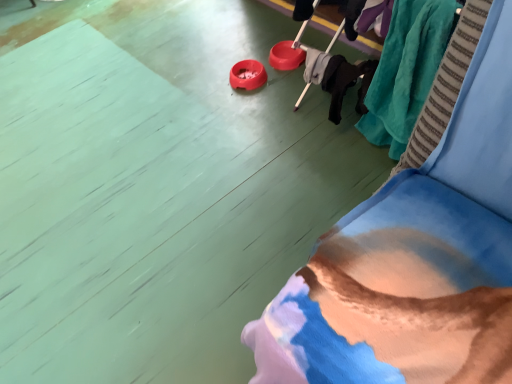
The image size is (512, 384). Describe the element at coordinates (414, 260) in the screenshot. I see `velvet blue couch at lower right` at that location.

Where is `velvet blue couch at lower right`? This screenshot has height=384, width=512. velvet blue couch at lower right is located at coordinates (414, 260).

The image size is (512, 384). I want to click on teal plush blanket at upper right, so click(x=406, y=70).

This screenshot has width=512, height=384. Describe the element at coordinates (406, 70) in the screenshot. I see `teal plush blanket at upper right` at that location.

You are a GUI agent. You are given a task and a screenshot of the screen. Output one action in this format:
    pyautogui.click(x=<x>, y=<y>)
    Task: Click on the velvet blue couch at lower right
    The height and width of the screenshot is (384, 512).
    Given the screenshot: What is the action you would take?
    pyautogui.click(x=414, y=260)

Which object is positioned more to the right, velvet blue couch at lower right or teal plush blanket at upper right?

teal plush blanket at upper right is more to the right.

Which object is further away from the camera taking this photo, velvet blue couch at lower right or teal plush blanket at upper right?

teal plush blanket at upper right.

Does point (396, 242) appear closer or farther from the camera than point (426, 7)?

Point (396, 242) is closer to the camera than point (426, 7).

From the image's perspective, which is above, velvet blue couch at lower right or teal plush blanket at upper right?

From the image's view, velvet blue couch at lower right is above.

From a real-world perspective, which object stands above the other?

From a 3D spatial view, teal plush blanket at upper right is above.

Does velvet blue couch at lower right have a lesser width compared to teal plush blanket at upper right?

No.

Does velvet blue couch at lower right have a lesser height compared to teal plush blanket at upper right?

Indeed, velvet blue couch at lower right has a lesser height compared to teal plush blanket at upper right.

Which of these two, velvet blue couch at lower right or teal plush blanket at upper right, is smaller?

Smaller between the two is teal plush blanket at upper right.

Can we say velvet blue couch at lower right lies outside teal plush blanket at upper right?

velvet blue couch at lower right lies outside teal plush blanket at upper right's area.

Is velvet blue couch at lower right not near teal plush blanket at upper right?

That's not correct — velvet blue couch at lower right is a little close to teal plush blanket at upper right.

Is teal plush blanket at upper right at the back of velvet blue couch at lower right?

No, teal plush blanket at upper right is not at the back of velvet blue couch at lower right.

Locate an element on the screen. The height and width of the screenshot is (384, 512). clothing behind the velvet blue couch at lower right is located at coordinates (406, 70).

Is teal plush blanket at upper right at the right side of velvet blue couch at lower right?

Yes.

Relative to velvet blue couch at lower right, is teal plush blanket at upper right in front or behind?

In the image, teal plush blanket at upper right appears behind velvet blue couch at lower right.

Does point (395, 98) appear closer or farther from the camera than point (395, 292)?

Point (395, 98) is farther from the camera than point (395, 292).

From the image's perspective, which one is positioned lower, teal plush blanket at upper right or velvet blue couch at lower right?

teal plush blanket at upper right is shown below in the image.

Based on the photo, from a real-world perspective, between teal plush blanket at upper right and velvet blue couch at lower right, who is vertically lower?

velvet blue couch at lower right, from a real-world perspective.

In terms of width, does teal plush blanket at upper right look wider or thinner when compared to velvet blue couch at lower right?

In the image, teal plush blanket at upper right appears to be more narrow than velvet blue couch at lower right.

Does teal plush blanket at upper right have a greater height compared to velvet blue couch at lower right?

Yes.

Between teal plush blanket at upper right and velvet blue couch at lower right, which one has larger size?

Bigger between the two is velvet blue couch at lower right.

Choose the correct answer: Is teal plush blanket at upper right inside velvet blue couch at lower right or outside it?

teal plush blanket at upper right lies outside velvet blue couch at lower right.

Is teal plush blanket at upper right far away from velvet blue couch at lower right?

That's not correct — teal plush blanket at upper right is a little close to velvet blue couch at lower right.

Is teal plush blanket at upper right facing away from velvet blue couch at lower right?

No, teal plush blanket at upper right is not facing away from velvet blue couch at lower right.

How different are the orientations of teal plush blanket at upper right and velvet blue couch at lower right in degrees?

There is a 0.000279-degree angle between the facing directions of teal plush blanket at upper right and velvet blue couch at lower right.

From the picture: Measure the distance between teal plush blanket at upper right and velvet blue couch at lower right.

A distance of 18.35 inches exists between teal plush blanket at upper right and velvet blue couch at lower right.

You are a GUI agent. You are given a task and a screenshot of the screen. Output one action in this format:
    pyautogui.click(x=<x>, y=<y>)
    Task: Click on the clothing on the right of velvet blue couch at lower right
    
    Given the screenshot: What is the action you would take?
    pyautogui.click(x=406, y=70)

This screenshot has width=512, height=384. Identify the location of furniture that is on the left side of teal plush blanket at upper right. (414, 260).

Locate an element on the screen. The height and width of the screenshot is (384, 512). clothing behind the velvet blue couch at lower right is located at coordinates (406, 70).